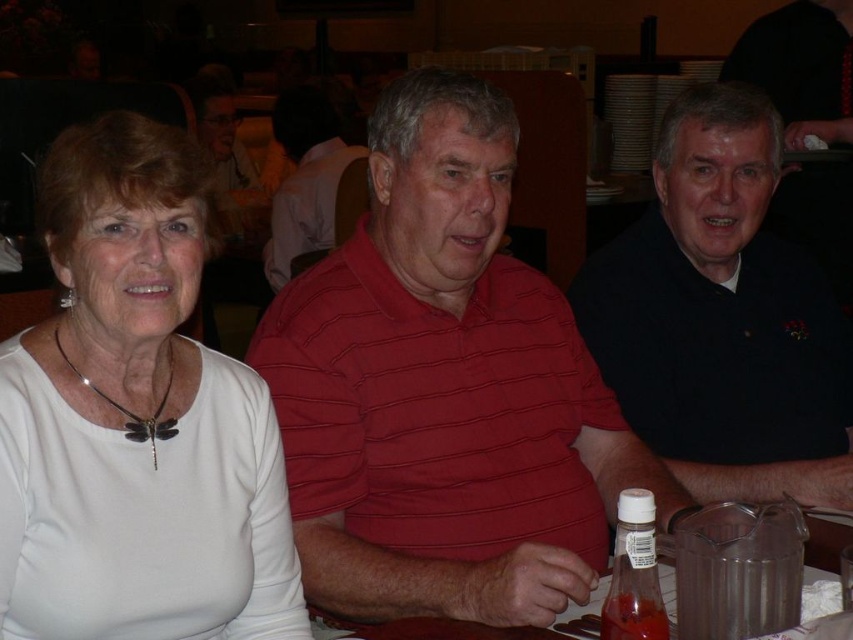
Which of these two, black smooth shirt at right or red striped shirt at center, stands shorter?

black smooth shirt at right

Who is more distant from viewer, (x=717, y=140) or (x=271, y=212)?

The point (x=271, y=212) is more distant.

Locate an element on the screen. black smooth shirt at right is located at coordinates (722, 317).

What are the coordinates of `black smooth shirt at right` in the screenshot? It's located at (722, 317).

Can you confirm if white matte shirt at left is positioned below black smooth shirt at right?

Yes.

Does white matte shirt at left appear on the right side of black smooth shirt at right?

No, white matte shirt at left is not to the right of black smooth shirt at right.

Image resolution: width=853 pixels, height=640 pixels. Describe the element at coordinates (136, 420) in the screenshot. I see `white matte shirt at left` at that location.

In order to click on white matte shirt at left in this screenshot , I will do `click(136, 420)`.

Is striped cotton shirt at center below red striped shirt at center?

Yes, striped cotton shirt at center is below red striped shirt at center.

Is striped cotton shirt at center positioned behind red striped shirt at center?

No, it is in front of red striped shirt at center.

The height and width of the screenshot is (640, 853). What do you see at coordinates (444, 390) in the screenshot?
I see `striped cotton shirt at center` at bounding box center [444, 390].

Image resolution: width=853 pixels, height=640 pixels. I want to click on striped cotton shirt at center, so click(x=444, y=390).